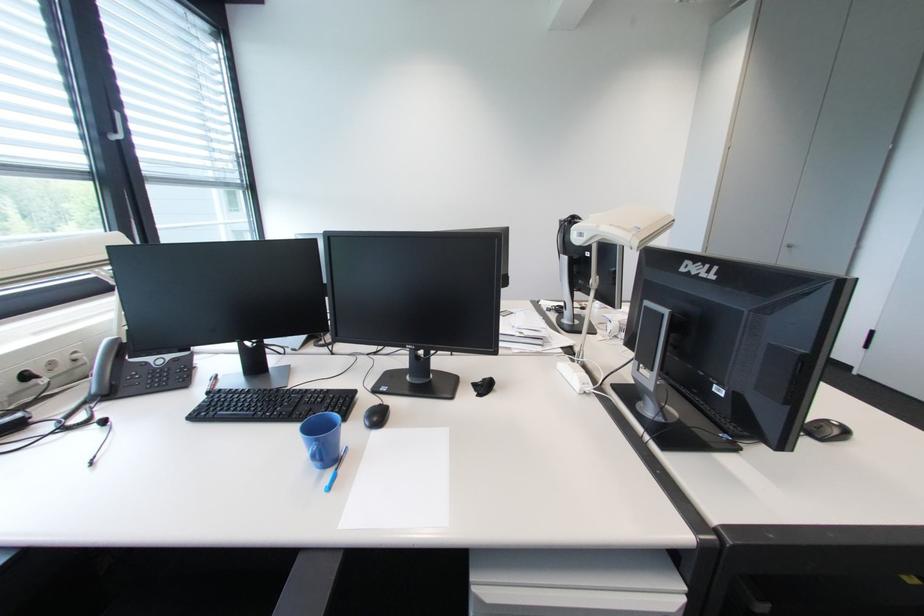
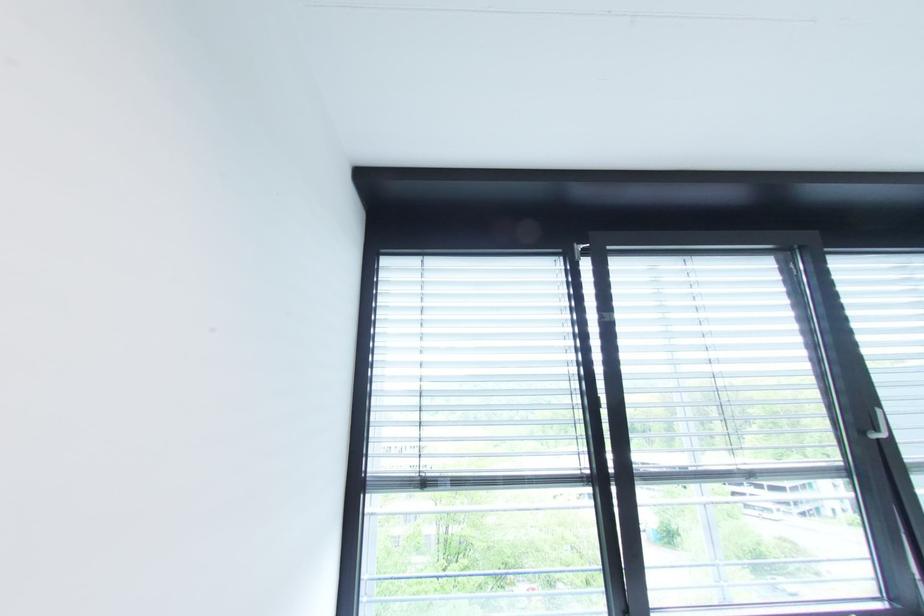
Find the pixel in the second image that matches [127,139] in the first image.

(889, 437)